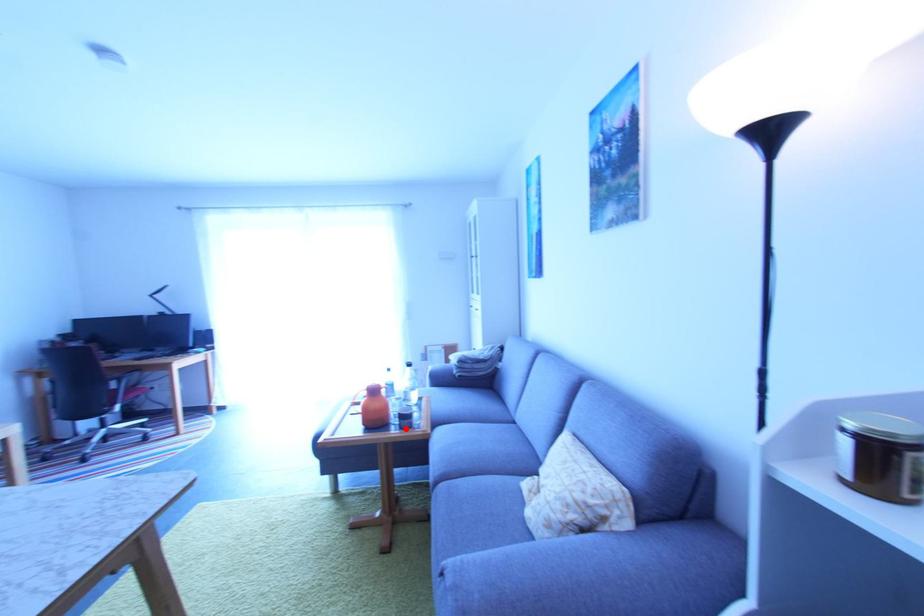
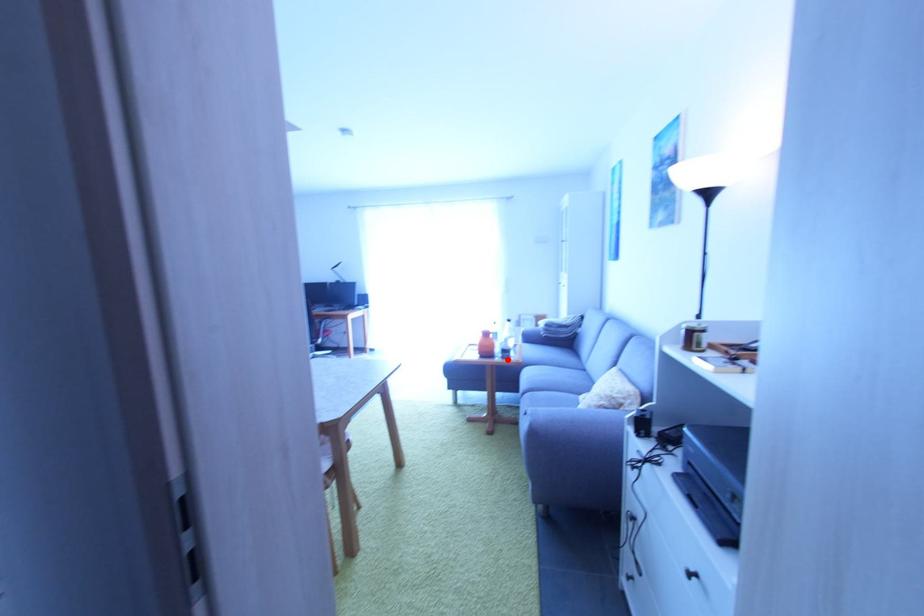
I am providing you with two images of the same scene from different viewpoints. A red point is marked on the first image and another point is marked on the second image. Are the points marked in image1 and image2 representing the same 3D position?

Yes